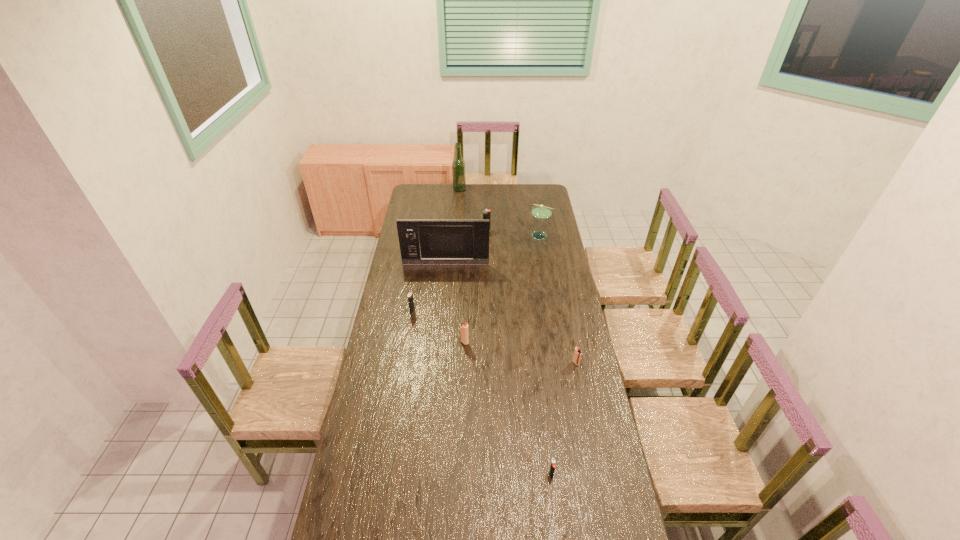
Where is `igniter that can be found as the fourth closest to the leftmost igniter`? The height and width of the screenshot is (540, 960). igniter that can be found as the fourth closest to the leftmost igniter is located at coordinates (552, 468).

The width and height of the screenshot is (960, 540). I want to click on igniter that is the fourth closest to the fourth farthest object, so click(577, 353).

The width and height of the screenshot is (960, 540). Find the location of `the third closest black igniter relative to the green martini`. the third closest black igniter relative to the green martini is located at coordinates (552, 468).

Identify the location of black igniter that is the second nearest to the smaller red igniter. The image size is (960, 540). (410, 295).

Where is `vacant space that satisfies the following two spatial constraints: 1. on the front panel of the rightmost igniter; 2. on the right side of the dark microwave oven`? The width and height of the screenshot is (960, 540). vacant space that satisfies the following two spatial constraints: 1. on the front panel of the rightmost igniter; 2. on the right side of the dark microwave oven is located at coordinates (437, 363).

The width and height of the screenshot is (960, 540). Identify the location of vacant region that satisfies the following two spatial constraints: 1. on the back side of the leftmost black igniter; 2. on the right side of the second black igniter from left to right. (425, 231).

What are the coordinates of `free location that satisfies the following two spatial constraints: 1. on the front panel of the microwave oven; 2. on the left side of the nearest object` in the screenshot? It's located at (426, 475).

You are a GUI agent. You are given a task and a screenshot of the screen. Output one action in this format:
    pyautogui.click(x=<x>, y=<y>)
    Task: Click on the blank area in the image that satisfies the following two spatial constraints: 1. on the back side of the green martini; 2. on the right side of the left red igniter
    
    Given the screenshot: What is the action you would take?
    pyautogui.click(x=468, y=235)